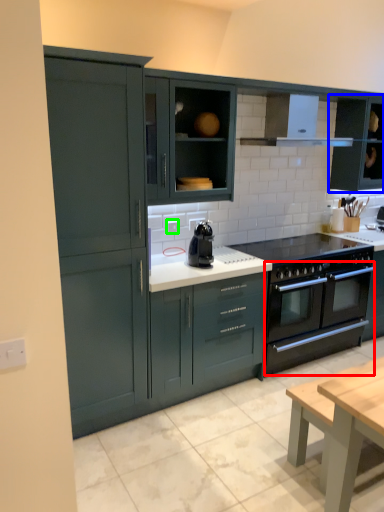
Question: Based on their relative distances, which object is nearer to oven (highlighted by a red box)? Choose from cabinetry (highlighted by a blue box) and electric outlet (highlighted by a green box).

Choices:
 (A) cabinetry
 (B) electric outlet

Answer: (A)